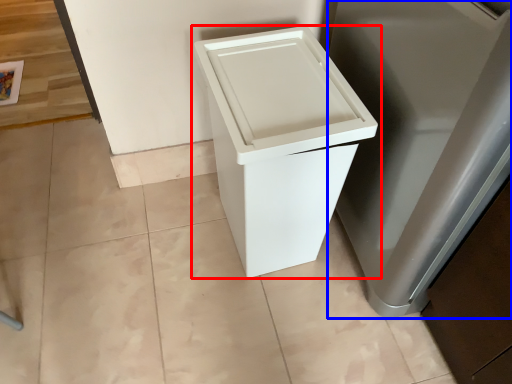
Question: Which of the following is the farthest to the observer, waste container (highlighted by a red box) or appliance (highlighted by a blue box)?

Choices:
 (A) waste container
 (B) appliance

Answer: (A)